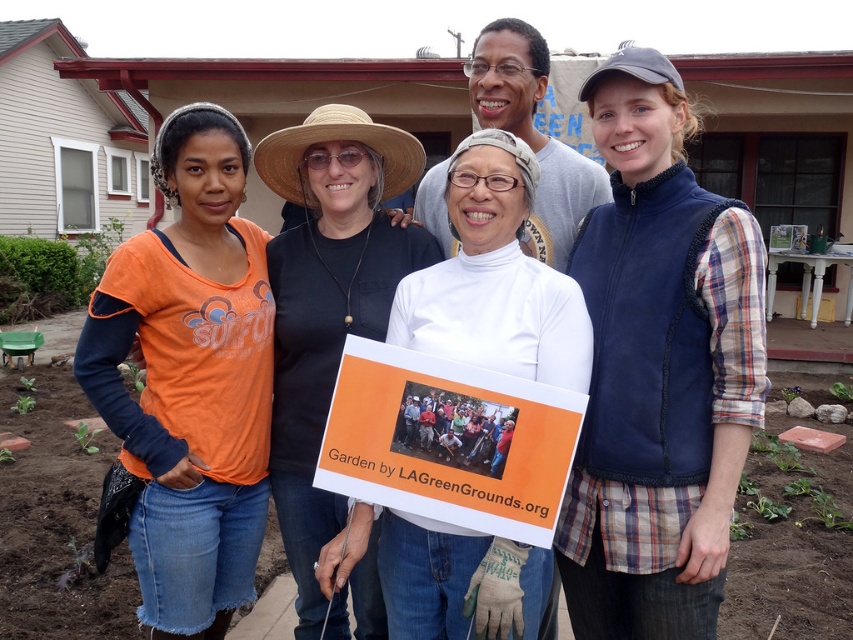
Question: Which point is closer to the camera taking this photo?

Choices:
 (A) (720, 248)
 (B) (544, 228)
 (C) (483, 454)

Answer: (C)

Question: Where is orange cotton shirt at left located in relation to white paper sign at center in the image?

Choices:
 (A) above
 (B) below

Answer: (A)

Question: Can you confirm if orange cotton shirt at left is positioned to the right of white matte turtleneck at center?

Choices:
 (A) no
 (B) yes

Answer: (A)

Question: Observing the image, what is the correct spatial positioning of white paper sign at center in reference to white matte turtleneck at center?

Choices:
 (A) above
 (B) below

Answer: (B)

Question: Which point is farther to the camera?

Choices:
 (A) (506, 68)
 (B) (173, 163)

Answer: (A)

Question: Among these objects, which one is nearest to the camera?

Choices:
 (A) white paper sign at center
 (B) white matte turtleneck at center

Answer: (A)